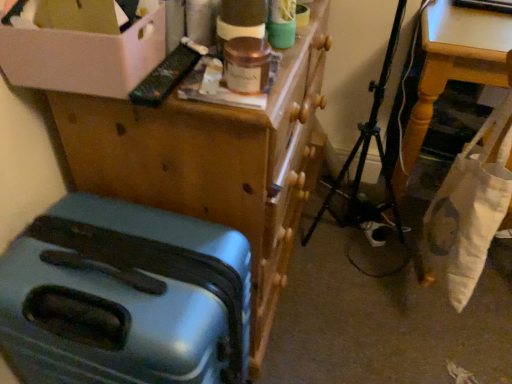
Image resolution: width=512 pixels, height=384 pixels. What do you see at coordinates (82, 58) in the screenshot?
I see `white cardboard box at upper left` at bounding box center [82, 58].

The image size is (512, 384). I want to click on white fabric bag at lower right, so click(x=364, y=164).

Identify the location of table on the right of white fabric bag at lower right. (453, 66).

From a real-world perspective, which is physically below, white fabric bag at lower right or wooden table at lower right?

wooden table at lower right is physically lower.

Between white fabric bag at lower right and wooden table at lower right, which one has smaller size?

Smaller between the two is white fabric bag at lower right.

Is white fabric bag at lower right inside the boundaries of wooden table at lower right, or outside?

white fabric bag at lower right is outside wooden table at lower right.

Is metallic blue suitcase at lower left turned away from teal plastic suitcase at lower left?

No, teal plastic suitcase at lower left is not at the back of metallic blue suitcase at lower left.

Does point (118, 290) come closer to viewer compared to point (178, 201)?

That is True.

Considering the sizes of objects metallic blue suitcase at lower left and teal plastic suitcase at lower left in the image provided, who is wider, metallic blue suitcase at lower left or teal plastic suitcase at lower left?

teal plastic suitcase at lower left is wider.

From a real-world perspective, is metallic blue suitcase at lower left physically located above or below teal plastic suitcase at lower left?

metallic blue suitcase at lower left is below teal plastic suitcase at lower left.

Between metallic blue suitcase at lower left and wooden table at lower right, which one appears on the left side from the viewer's perspective?

From the viewer's perspective, metallic blue suitcase at lower left appears more on the left side.

Consider the image. Considering the positions of objects metallic blue suitcase at lower left and wooden table at lower right in the image provided, who is in front, metallic blue suitcase at lower left or wooden table at lower right?

Positioned in front is metallic blue suitcase at lower left.

Is metallic blue suitcase at lower left positioned with its back to wooden table at lower right?

No, metallic blue suitcase at lower left's orientation is not away from wooden table at lower right.

From a real-world perspective, between metallic blue suitcase at lower left and wooden table at lower right, who is vertically higher?

wooden table at lower right, from a real-world perspective.

Which object is more forward, teal plastic suitcase at lower left or white cardboard box at upper left?

white cardboard box at upper left is in front.

Is teal plastic suitcase at lower left surrounding white cardboard box at upper left?

That's incorrect, white cardboard box at upper left is not inside teal plastic suitcase at lower left.

Considering the relative sizes of teal plastic suitcase at lower left and white cardboard box at upper left in the image provided, is teal plastic suitcase at lower left bigger than white cardboard box at upper left?

Yes, teal plastic suitcase at lower left is bigger than white cardboard box at upper left.

Is white cardboard box at upper left bigger or smaller than metallic blue suitcase at lower left?

Clearly, white cardboard box at upper left is smaller in size than metallic blue suitcase at lower left.

Is white cardboard box at upper left facing away from metallic blue suitcase at lower left?

No, white cardboard box at upper left's orientation is not away from metallic blue suitcase at lower left.

Which is behind, white cardboard box at upper left or metallic blue suitcase at lower left?

white cardboard box at upper left.

Is white cardboard box at upper left taller or shorter than metallic blue suitcase at lower left?

white cardboard box at upper left is shorter than metallic blue suitcase at lower left.

Is wooden table at lower right at the back of white cardboard box at upper left?

No, white cardboard box at upper left's orientation is not away from wooden table at lower right.

Are white cardboard box at upper left and wooden table at lower right located far from each other?

No, white cardboard box at upper left is in close proximity to wooden table at lower right.

Considering the relative sizes of white cardboard box at upper left and wooden table at lower right in the image provided, is white cardboard box at upper left taller than wooden table at lower right?

No.

Is teal plastic suitcase at lower left spatially inside metallic blue suitcase at lower left, or outside of it?

teal plastic suitcase at lower left lies outside metallic blue suitcase at lower left.

Considering the sizes of teal plastic suitcase at lower left and metallic blue suitcase at lower left in the image, is teal plastic suitcase at lower left wider or thinner than metallic blue suitcase at lower left?

Considering their sizes, teal plastic suitcase at lower left looks broader than metallic blue suitcase at lower left.

Can you confirm if teal plastic suitcase at lower left is smaller than metallic blue suitcase at lower left?

Actually, teal plastic suitcase at lower left might be larger than metallic blue suitcase at lower left.

From the image's perspective, is teal plastic suitcase at lower left below metallic blue suitcase at lower left?

Incorrect, from the image's perspective, teal plastic suitcase at lower left is higher than metallic blue suitcase at lower left.

In order to click on folding chair on the left of wooden table at lower right in this screenshot , I will do `click(364, 164)`.

You are a GUI agent. You are given a task and a screenshot of the screen. Output one action in this format:
    pyautogui.click(x=<x>, y=<y>)
    Task: Click on the furniture above the metallic blue suitcase at lower left (from a real-world perspective)
    Image resolution: width=512 pixels, height=384 pixels.
    Given the screenshot: What is the action you would take?
    pyautogui.click(x=215, y=161)

Based on their spatial positions, is teal plastic suitcase at lower left or white fabric bag at lower right closer to wooden table at lower right?

white fabric bag at lower right lies closer to wooden table at lower right than the other object.

Which object lies nearer to the anchor point metallic blue suitcase at lower left, white cardboard box at upper left or teal plastic suitcase at lower left?

Among the two, teal plastic suitcase at lower left is located nearer to metallic blue suitcase at lower left.

From the image, which object appears to be nearer to wooden table at lower right, white cardboard box at upper left or metallic blue suitcase at lower left?

white cardboard box at upper left lies closer to wooden table at lower right than the other object.

Estimate the real-world distances between objects in this image. Which object is closer to teal plastic suitcase at lower left, white fabric bag at lower right or wooden table at lower right?

The object closer to teal plastic suitcase at lower left is wooden table at lower right.

Looking at the image, which one is located closer to teal plastic suitcase at lower left, wooden table at lower right or metallic blue suitcase at lower left?

metallic blue suitcase at lower left.

Based on their spatial positions, is wooden table at lower right or teal plastic suitcase at lower left further from white fabric bag at lower right?

Among the two, teal plastic suitcase at lower left is located further to white fabric bag at lower right.

Which object lies further to the anchor point teal plastic suitcase at lower left, white fabric bag at lower right or white cardboard box at upper left?

white fabric bag at lower right.

Based on their spatial positions, is wooden table at lower right or teal plastic suitcase at lower left further from metallic blue suitcase at lower left?

The object further to metallic blue suitcase at lower left is wooden table at lower right.

In order to click on folding chair situated between white cardboard box at upper left and wooden table at lower right from left to right in this screenshot , I will do `click(364, 164)`.

In order to click on furniture between white cardboard box at upper left and white fabric bag at lower right in this screenshot , I will do `click(215, 161)`.

Locate an element on the screen. This screenshot has width=512, height=384. furniture between white cardboard box at upper left and wooden table at lower right is located at coordinates (215, 161).

Image resolution: width=512 pixels, height=384 pixels. In order to click on furniture between white cardboard box at upper left and metallic blue suitcase at lower left in the vertical direction in this screenshot , I will do `click(215, 161)`.